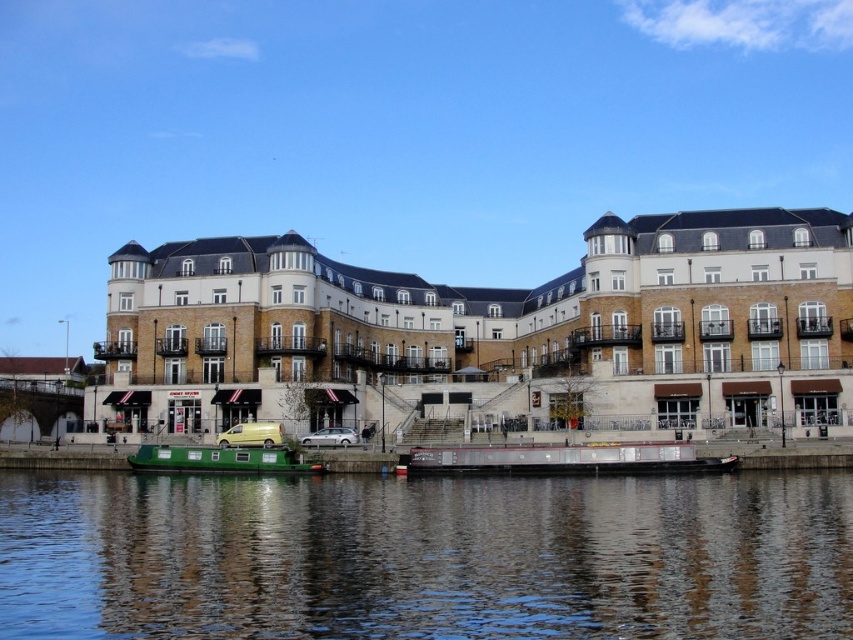
Does green matte boat at lower center have a smaller size compared to metallic yellow van at center?

No.

Which is behind, point (193, 486) or point (236, 429)?

The point (236, 429) is more distant.

The image size is (853, 640). Identify the location of green matte boat at lower center. (424, 556).

Does white stone building at center appear on the right side of green matte boat at lower left?

Correct, you'll find white stone building at center to the right of green matte boat at lower left.

Can you confirm if white stone building at center is taller than green matte boat at lower left?

Yes, white stone building at center is taller than green matte boat at lower left.

You are a GUI agent. You are given a task and a screenshot of the screen. Output one action in this format:
    pyautogui.click(x=<x>, y=<y>)
    Task: Click on the white stone building at center
    The height and width of the screenshot is (640, 853).
    Given the screenshot: What is the action you would take?
    coord(495,330)

The width and height of the screenshot is (853, 640). I want to click on white stone building at center, so [x=495, y=330].

Is white stone building at center above green painted wooden barge at center?

Correct, white stone building at center is located above green painted wooden barge at center.

Is white stone building at center to the left of green painted wooden barge at center from the viewer's perspective?

In fact, white stone building at center is to the right of green painted wooden barge at center.

I want to click on white stone building at center, so click(495, 330).